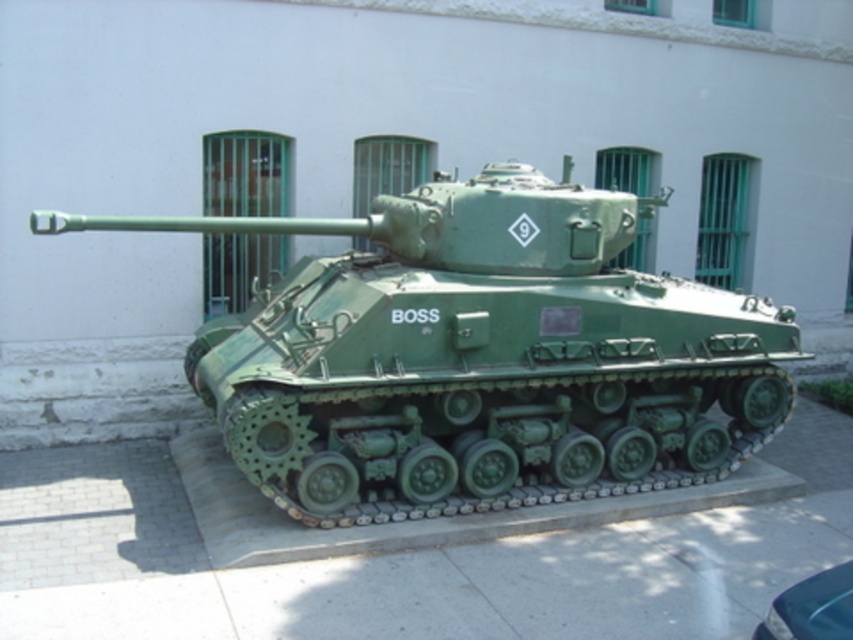
You are a tour guide explaining the tank exhibit to visitors. You want to mention the green rubber tracks at lower center and the shiny black car at lower right in your description. How are these two objects positioned relative to each other?

The green rubber tracks at lower center are positioned on the left side of the shiny black car at lower right.

Looking at this image, you are standing in front of a military tank exhibit. The tank is on a raised platform, and you want to take a photo of the tank. There is a specific point at coordinates point (482, 280) that you need to focus on. If you are 6.52 meters away from this point, is it possible to capture the entire tank in your photo without moving closer?

The point (482, 280) is 6.52 meters away from the viewer. Since the tank is on a raised platform and the distance is sufficient, it is possible to capture the entire tank in the photo without moving closer.